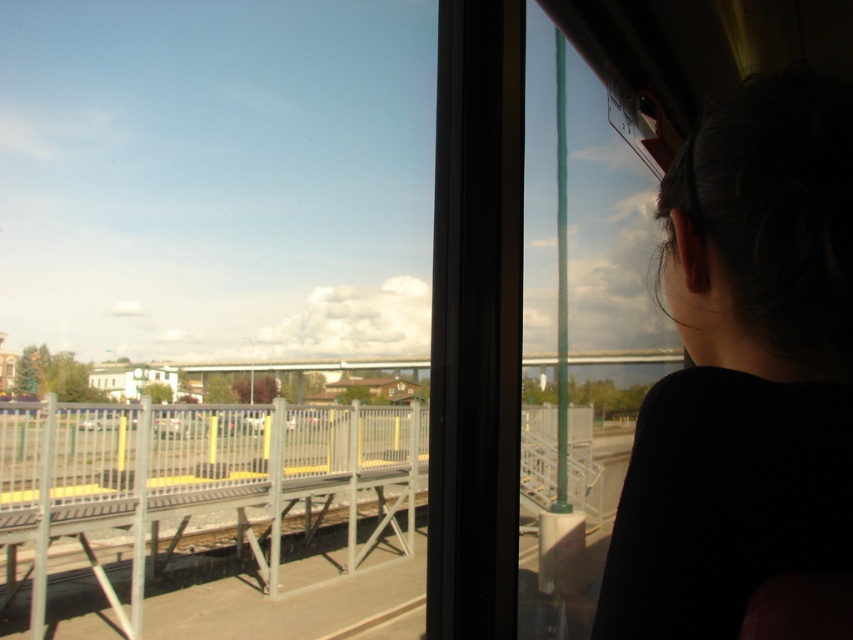
Question: Which point appears closest to the camera in this image?

Choices:
 (A) (241, 508)
 (B) (752, 404)

Answer: (B)

Question: Does dark hair at upper right have a larger size compared to metal/textured rail at center?

Choices:
 (A) no
 (B) yes

Answer: (A)

Question: Does dark hair at upper right appear on the right side of metal/textured rail at center?

Choices:
 (A) yes
 (B) no

Answer: (A)

Question: Is dark hair at upper right positioned before metal/textured rail at center?

Choices:
 (A) yes
 (B) no

Answer: (A)